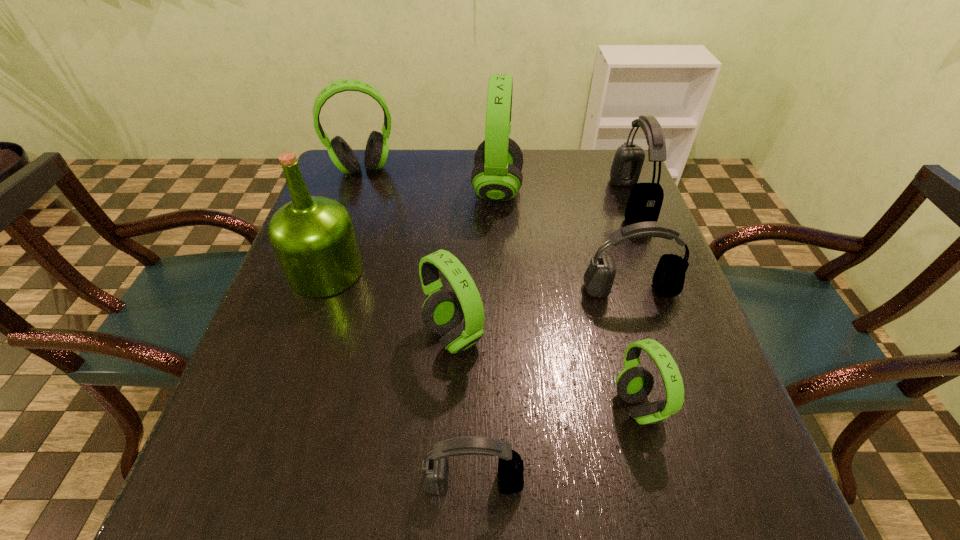
The image size is (960, 540). I want to click on vacant space that satisfies the following two spatial constraints: 1. on the headband of the biggest black headset; 2. on the front side of the green olive oil, so click(x=657, y=271).